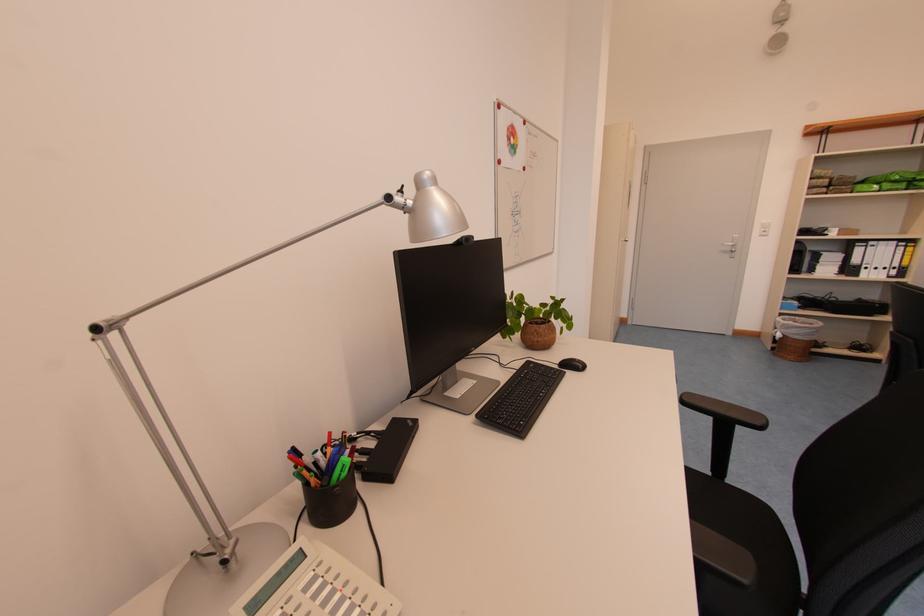
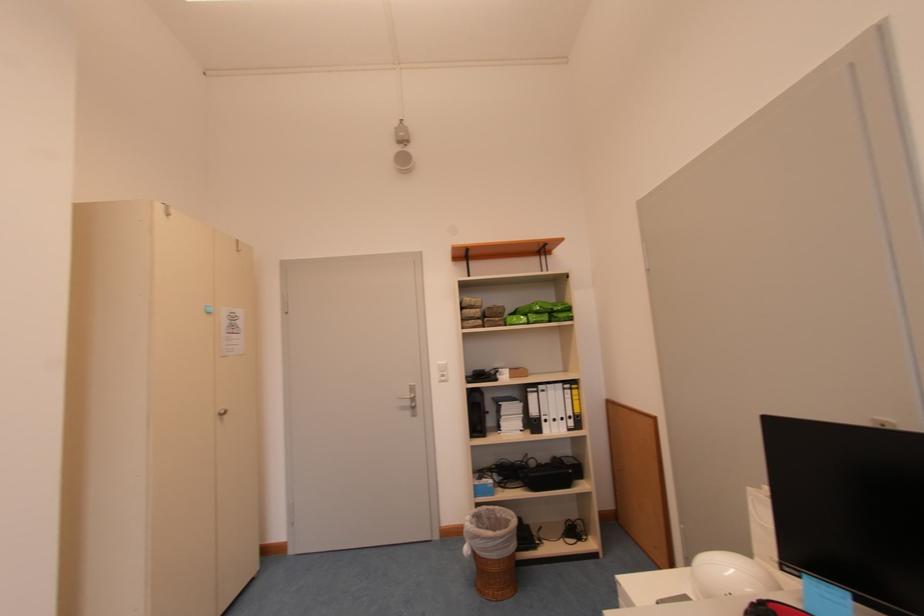
Locate, in the second image, the point that corresponds to point 873,270 in the first image.

(553, 424)